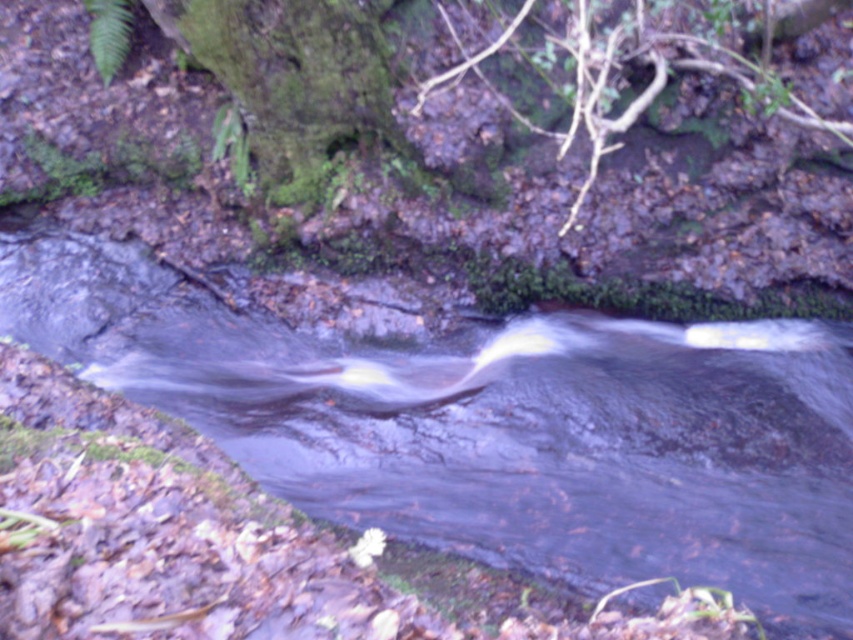
Who is positioned more to the left, clear water at center or green mossy tree trunk at upper center?

Positioned to the left is green mossy tree trunk at upper center.

Which is more to the right, clear water at center or green mossy tree trunk at upper center?

clear water at center is more to the right.

Locate an element on the screen. Image resolution: width=853 pixels, height=640 pixels. clear water at center is located at coordinates (492, 424).